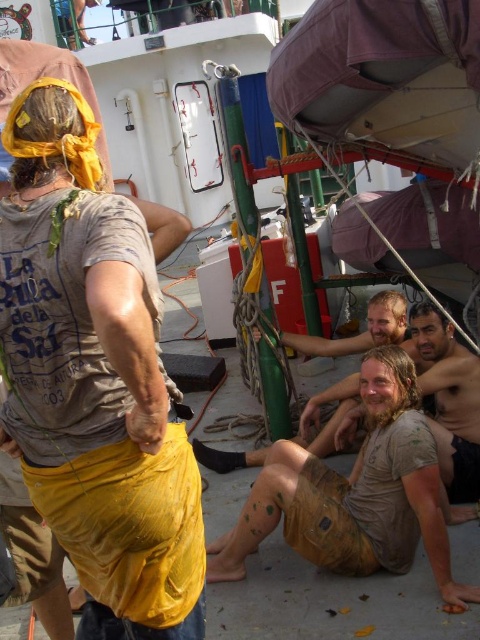
Question: Which object is the farthest from the dirty beige shorts at lower right?

Choices:
 (A) yellow fabric at center
 (B) brown textured shorts at lower center

Answer: (A)

Question: Which of the following is the closest to the observer?

Choices:
 (A) (113, 328)
 (B) (392, 400)

Answer: (A)

Question: Which of the following is the farthest from the observer?

Choices:
 (A) dirty beige shorts at lower right
 (B) yellow fabric at center

Answer: (A)

Question: Is yellow fabric at center thinner than brown textured shorts at lower center?

Choices:
 (A) no
 (B) yes

Answer: (B)

Question: Is yellow fabric at center to the left of brown textured shorts at lower center from the viewer's perspective?

Choices:
 (A) no
 (B) yes

Answer: (B)

Question: Is yellow fabric at center closer to camera compared to dirty beige shorts at lower right?

Choices:
 (A) yes
 (B) no

Answer: (A)